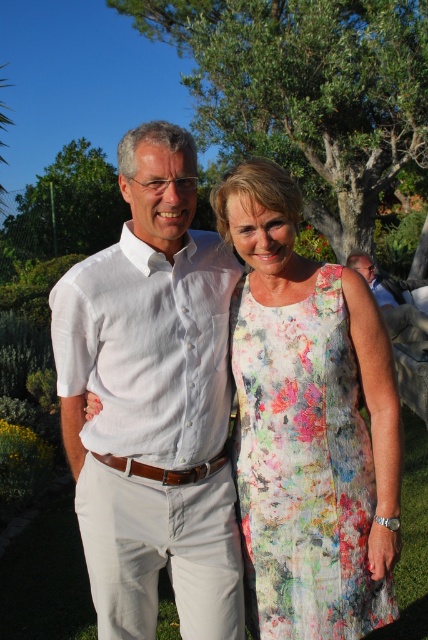
Which is more to the left, floral printed fabric dress at center or matte brown leather belt at lower right?

Positioned to the left is floral printed fabric dress at center.

This screenshot has width=428, height=640. What do you see at coordinates (303, 468) in the screenshot? I see `floral printed fabric dress at center` at bounding box center [303, 468].

Which is behind, point (363, 492) or point (409, 316)?

The point (409, 316) is behind.

At what (x,y) coordinates should I click in order to perform the action: click on floral printed fabric dress at center. Please return your answer as a coordinate pair (x, y). This screenshot has width=428, height=640. Looking at the image, I should click on (303, 468).

Does white linen shirt at center appear under floral printed fabric dress at center?

Actually, white linen shirt at center is above floral printed fabric dress at center.

Can you confirm if white linen shirt at center is shorter than floral printed fabric dress at center?

In fact, white linen shirt at center may be taller than floral printed fabric dress at center.

The width and height of the screenshot is (428, 640). I want to click on white linen shirt at center, so click(x=152, y=403).

Does white linen shirt at center have a larger size compared to matte brown leather belt at lower right?

No.

Does point (198, 316) come behind point (395, 321)?

No.

The image size is (428, 640). I want to click on white linen shirt at center, so click(152, 403).

What are the coordinates of `white linen shirt at center` in the screenshot? It's located at pos(152,403).